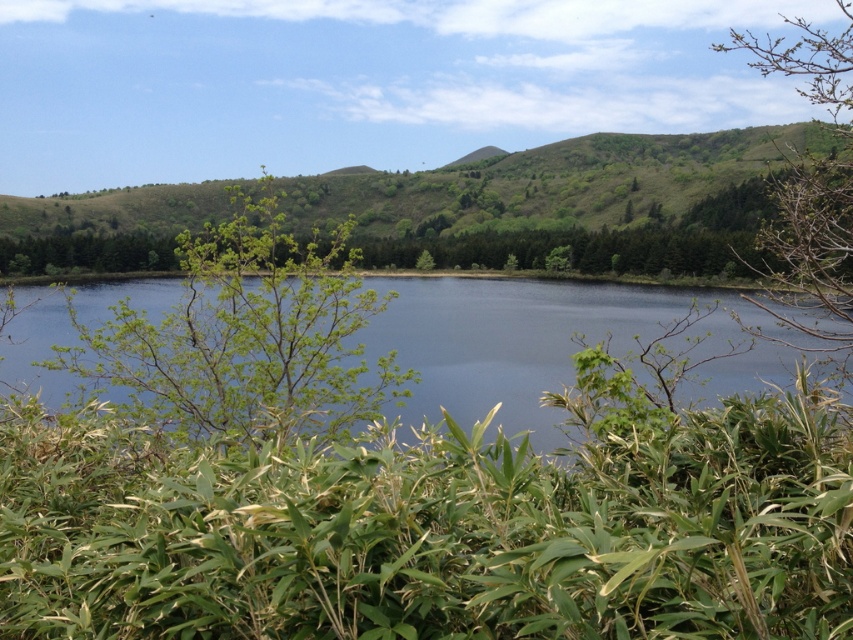
Between green leafy tree at center and transparent blue water at center, which one has more height?

transparent blue water at center

Which is more to the left, green leafy tree at center or transparent blue water at center?

From the viewer's perspective, transparent blue water at center appears more on the left side.

Is point (236, 374) in front of point (555, 355)?

Yes, it is.

The height and width of the screenshot is (640, 853). I want to click on green leafy tree at center, so click(x=248, y=336).

Can you confirm if green leafy tree at center is bigger than green leafy tree at upper right?

Actually, green leafy tree at center might be smaller than green leafy tree at upper right.

Measure the distance between green leafy tree at center and camera.

green leafy tree at center is 3.50 meters away from camera.

The height and width of the screenshot is (640, 853). Describe the element at coordinates (248, 336) in the screenshot. I see `green leafy tree at center` at that location.

You are a GUI agent. You are given a task and a screenshot of the screen. Output one action in this format:
    pyautogui.click(x=<x>, y=<y>)
    Task: Click on the green leafy tree at center
    This screenshot has width=853, height=640.
    Given the screenshot: What is the action you would take?
    pyautogui.click(x=248, y=336)

Which of these two, transparent blue water at center or green leafy tree at upper right, stands shorter?

transparent blue water at center

Is transparent blue water at center thinner than green leafy tree at upper right?

Yes, transparent blue water at center is thinner than green leafy tree at upper right.

Between point (512, 394) and point (735, 36), which one is positioned in front?

Point (512, 394) is more forward.

This screenshot has height=640, width=853. Identify the location of transparent blue water at center. tap(521, 340).